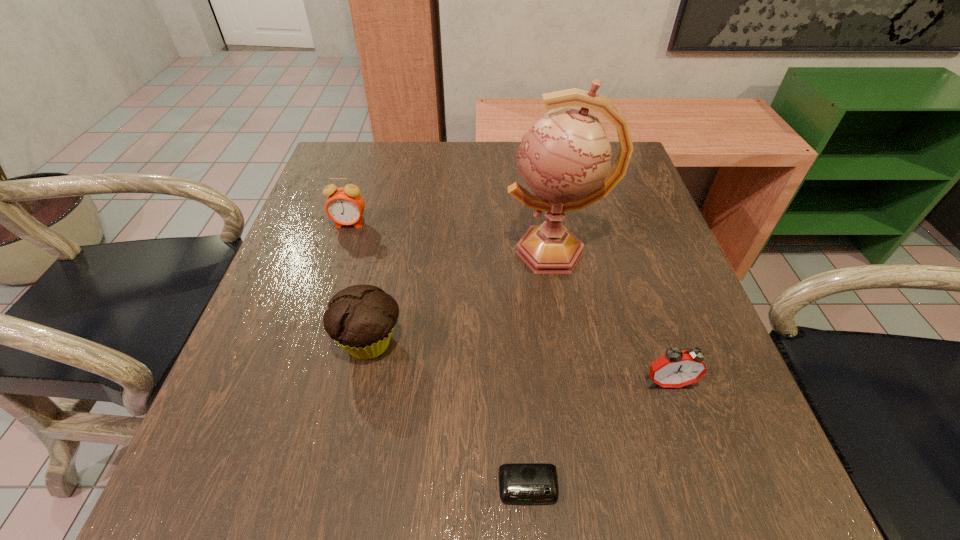
Where is `vacant space at the far edge`? This screenshot has height=540, width=960. vacant space at the far edge is located at coordinates (512, 167).

At what (x,y) coordinates should I click in order to perform the action: click on blank space at the near edge of the desktop. Please return your answer as a coordinate pair (x, y). The width and height of the screenshot is (960, 540). Looking at the image, I should click on (366, 471).

Where is `vacant area at the left edge of the desktop`? vacant area at the left edge of the desktop is located at coordinates (305, 325).

Locate an element on the screen. Image resolution: width=960 pixels, height=540 pixels. free region at the right edge is located at coordinates (612, 289).

This screenshot has width=960, height=540. What are the coordinates of `free region at the near left corner of the desktop` in the screenshot? It's located at (262, 519).

The image size is (960, 540). Find the location of `free space at the near right corner`. free space at the near right corner is located at coordinates (667, 474).

At what (x,y) coordinates should I click in order to perform the action: click on free space between the rightmost alarm clock and the nearest object. Please return your answer as a coordinate pair (x, y). Looking at the image, I should click on (598, 435).

The image size is (960, 540). I want to click on vacant point located between the rightmost object and the shortest alarm clock, so click(x=598, y=435).

The height and width of the screenshot is (540, 960). I want to click on vacant space that is in between the farthest alarm clock and the third farthest object, so click(x=360, y=284).

Find the location of a particular element. This screenshot has height=540, width=960. free point between the second alarm clock from left to right and the muffin is located at coordinates (449, 415).